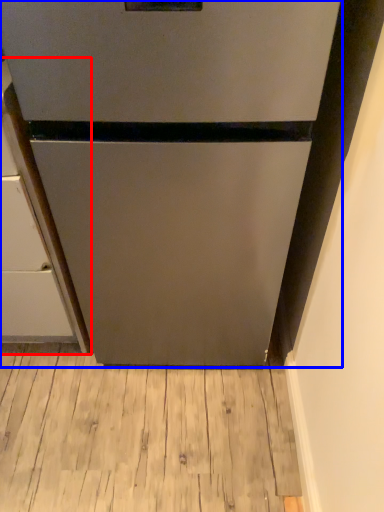
Question: Among these objects, which one is nearest to the camera, cabinetry (highlighted by a red box) or refrigerator (highlighted by a blue box)?

Choices:
 (A) cabinetry
 (B) refrigerator

Answer: (B)